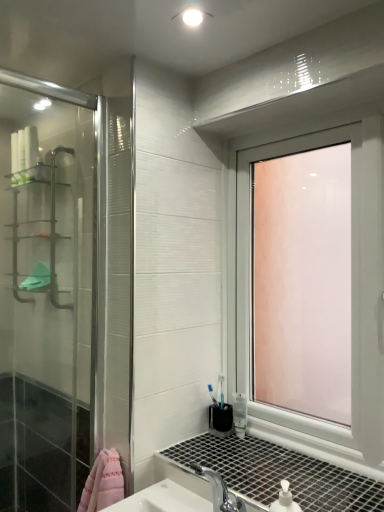
Question: Can you confirm if metallic silver shelf at left is positioned to the left of transparent glass window at upper right?

Choices:
 (A) no
 (B) yes

Answer: (B)

Question: From the image's perspective, is metallic silver shelf at left beneath transparent glass window at upper right?

Choices:
 (A) no
 (B) yes

Answer: (A)

Question: Is metallic silver shelf at left located outside transparent glass window at upper right?

Choices:
 (A) no
 (B) yes

Answer: (B)

Question: Is metallic silver shelf at left looking in the opposite direction of transparent glass window at upper right?

Choices:
 (A) yes
 (B) no

Answer: (B)

Question: From a real-world perspective, is metallic silver shelf at left over transparent glass window at upper right?

Choices:
 (A) yes
 (B) no

Answer: (A)

Question: Is metallic silver shelf at left aimed at transparent glass window at upper right?

Choices:
 (A) yes
 (B) no

Answer: (B)

Question: Considering the relative sizes of transparent glass window at upper right and metallic silver shelf at left in the image provided, is transparent glass window at upper right thinner than metallic silver shelf at left?

Choices:
 (A) yes
 (B) no

Answer: (A)

Question: Considering the relative sizes of transparent glass window at upper right and metallic silver shelf at left in the image provided, is transparent glass window at upper right smaller than metallic silver shelf at left?

Choices:
 (A) yes
 (B) no

Answer: (B)

Question: From a real-world perspective, is transparent glass window at upper right physically above metallic silver shelf at left?

Choices:
 (A) yes
 (B) no

Answer: (B)

Question: Is transparent glass window at upper right positioned behind metallic silver shelf at left?

Choices:
 (A) no
 (B) yes

Answer: (A)

Question: Is the depth of transparent glass window at upper right less than that of metallic silver shelf at left?

Choices:
 (A) no
 (B) yes

Answer: (B)

Question: Is transparent glass window at upper right facing away from metallic silver shelf at left?

Choices:
 (A) no
 (B) yes

Answer: (A)

Question: From a real-world perspective, is metallic silver shelf at left physically located above or below transparent glass window at upper right?

Choices:
 (A) below
 (B) above

Answer: (B)